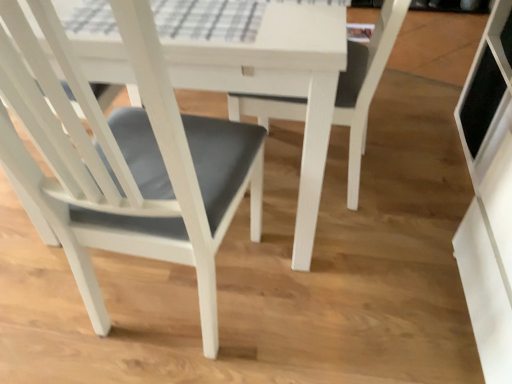
The height and width of the screenshot is (384, 512). What do you see at coordinates (125, 160) in the screenshot?
I see `matte gray cushion at center, positioned as the first chair in left-to-right order` at bounding box center [125, 160].

I want to click on matte gray cushion at center, placed as the second chair when sorted from right to left, so click(x=125, y=160).

What do you see at coordinates (365, 86) in the screenshot? The image size is (512, 384). I see `matte gray cushion at center, which is counted as the 1th chair, starting from the right` at bounding box center [365, 86].

Where is `matte gray cushion at center, which is counted as the 1th chair, starting from the right`? The image size is (512, 384). matte gray cushion at center, which is counted as the 1th chair, starting from the right is located at coordinates (365, 86).

At what (x,y) coordinates should I click in order to perform the action: click on matte gray cushion at center, placed as the second chair when sorted from right to left. Please return your answer as a coordinate pair (x, y). Looking at the image, I should click on (125, 160).

Considering the relative positions of matte gray cushion at center, placed as the second chair when sorted from right to left, and matte gray cushion at center, positioned as the 2th chair in left-to-right order, in the image provided, is matte gray cushion at center, placed as the second chair when sorted from right to left, to the left or to the right of matte gray cushion at center, positioned as the 2th chair in left-to-right order,?

From the image, it's evident that matte gray cushion at center, placed as the second chair when sorted from right to left, is to the left of matte gray cushion at center, positioned as the 2th chair in left-to-right order.

Considering the positions of objects matte gray cushion at center, placed as the second chair when sorted from right to left, and matte gray cushion at center, positioned as the 2th chair in left-to-right order, in the image provided, who is in front, matte gray cushion at center, placed as the second chair when sorted from right to left, or matte gray cushion at center, positioned as the 2th chair in left-to-right order,?

matte gray cushion at center, placed as the second chair when sorted from right to left, is more forward.

Does point (195, 150) appear closer or farther from the camera than point (348, 172)?

Point (195, 150) is closer to the camera than point (348, 172).

From the image's perspective, is matte gray cushion at center, positioned as the first chair in left-to-right order, beneath matte gray cushion at center, which is counted as the 1th chair, starting from the right?

No, from the image's perspective, matte gray cushion at center, positioned as the first chair in left-to-right order, is not beneath matte gray cushion at center, which is counted as the 1th chair, starting from the right.

From a real-world perspective, is matte gray cushion at center, positioned as the first chair in left-to-right order, above or below matte gray cushion at center, which is counted as the 1th chair, starting from the right?

From a real-world perspective, matte gray cushion at center, positioned as the first chair in left-to-right order, is physically below matte gray cushion at center, which is counted as the 1th chair, starting from the right.

Considering the sizes of matte gray cushion at center, positioned as the first chair in left-to-right order, and matte gray cushion at center, positioned as the 2th chair in left-to-right order, in the image, is matte gray cushion at center, positioned as the first chair in left-to-right order, wider or thinner than matte gray cushion at center, positioned as the 2th chair in left-to-right order,?

Considering their sizes, matte gray cushion at center, positioned as the first chair in left-to-right order, looks broader than matte gray cushion at center, positioned as the 2th chair in left-to-right order.

Between matte gray cushion at center, positioned as the first chair in left-to-right order, and matte gray cushion at center, positioned as the 2th chair in left-to-right order, which one has more height?

matte gray cushion at center, positioned as the 2th chair in left-to-right order.

Which of these two, matte gray cushion at center, positioned as the first chair in left-to-right order, or matte gray cushion at center, positioned as the 2th chair in left-to-right order, is smaller?

matte gray cushion at center, positioned as the 2th chair in left-to-right order.

Is matte gray cushion at center, positioned as the 2th chair in left-to-right order, inside matte gray cushion at center, positioned as the first chair in left-to-right order?

Yes, matte gray cushion at center, positioned as the 2th chair in left-to-right order, can be found within matte gray cushion at center, positioned as the first chair in left-to-right order.

Is matte gray cushion at center, placed as the second chair when sorted from right to left, directly adjacent to matte gray cushion at center, which is counted as the 1th chair, starting from the right?

They are not placed beside each other.

Based on the photo, could you tell me if matte gray cushion at center, positioned as the first chair in left-to-right order, is facing matte gray cushion at center, which is counted as the 1th chair, starting from the right?

Yes, matte gray cushion at center, positioned as the first chair in left-to-right order, is facing matte gray cushion at center, which is counted as the 1th chair, starting from the right.

What's the angular difference between matte gray cushion at center, placed as the second chair when sorted from right to left, and matte gray cushion at center, positioned as the 2th chair in left-to-right order,'s facing directions?

The facing directions of matte gray cushion at center, placed as the second chair when sorted from right to left, and matte gray cushion at center, positioned as the 2th chair in left-to-right order, are 5.62 degrees apart.

This screenshot has width=512, height=384. Find the location of `chair on the right side of matte gray cushion at center, positioned as the first chair in left-to-right order`. chair on the right side of matte gray cushion at center, positioned as the first chair in left-to-right order is located at coordinates (365, 86).

Which is more to the left, matte gray cushion at center, positioned as the 2th chair in left-to-right order, or matte gray cushion at center, placed as the second chair when sorted from right to left?

Positioned to the left is matte gray cushion at center, placed as the second chair when sorted from right to left.

Who is more distant, matte gray cushion at center, positioned as the 2th chair in left-to-right order, or matte gray cushion at center, placed as the second chair when sorted from right to left?

Positioned behind is matte gray cushion at center, positioned as the 2th chair in left-to-right order.

Is point (385, 21) farther from camera compared to point (67, 165)?

Yes, point (385, 21) is behind point (67, 165).

From the image's perspective, who appears lower, matte gray cushion at center, which is counted as the 1th chair, starting from the right, or matte gray cushion at center, positioned as the first chair in left-to-right order?

matte gray cushion at center, which is counted as the 1th chair, starting from the right, is shown below in the image.

From a real-world perspective, is matte gray cushion at center, positioned as the 2th chair in left-to-right order, physically located above or below matte gray cushion at center, positioned as the first chair in left-to-right order?

matte gray cushion at center, positioned as the 2th chair in left-to-right order, is situated higher than matte gray cushion at center, positioned as the first chair in left-to-right order, in the real world.

Considering the sizes of objects matte gray cushion at center, which is counted as the 1th chair, starting from the right, and matte gray cushion at center, positioned as the first chair in left-to-right order, in the image provided, who is thinner, matte gray cushion at center, which is counted as the 1th chair, starting from the right, or matte gray cushion at center, positioned as the first chair in left-to-right order,?

Thinner between the two is matte gray cushion at center, which is counted as the 1th chair, starting from the right.

Is matte gray cushion at center, positioned as the 2th chair in left-to-right order, taller than matte gray cushion at center, positioned as the first chair in left-to-right order?

Correct, matte gray cushion at center, positioned as the 2th chair in left-to-right order, is much taller as matte gray cushion at center, positioned as the first chair in left-to-right order.

Considering the relative sizes of matte gray cushion at center, which is counted as the 1th chair, starting from the right, and matte gray cushion at center, positioned as the first chair in left-to-right order, in the image provided, is matte gray cushion at center, which is counted as the 1th chair, starting from the right, bigger than matte gray cushion at center, positioned as the first chair in left-to-right order,?

Actually, matte gray cushion at center, which is counted as the 1th chair, starting from the right, might be smaller than matte gray cushion at center, positioned as the first chair in left-to-right order.

Is matte gray cushion at center, positioned as the 2th chair in left-to-right order, inside the boundaries of matte gray cushion at center, positioned as the first chair in left-to-right order, or outside?

matte gray cushion at center, positioned as the 2th chair in left-to-right order, can be found inside matte gray cushion at center, positioned as the first chair in left-to-right order.

Is matte gray cushion at center, which is counted as the 1th chair, starting from the right, next to matte gray cushion at center, placed as the second chair when sorted from right to left, and touching it?

No.

Could you tell me if matte gray cushion at center, positioned as the 2th chair in left-to-right order, is facing matte gray cushion at center, positioned as the first chair in left-to-right order?

Yes.

Looking at this image, how different are the orientations of matte gray cushion at center, positioned as the 2th chair in left-to-right order, and matte gray cushion at center, positioned as the first chair in left-to-right order, in degrees?

The facing directions of matte gray cushion at center, positioned as the 2th chair in left-to-right order, and matte gray cushion at center, positioned as the first chair in left-to-right order, are 5.62 degrees apart.

How distant is matte gray cushion at center, which is counted as the 1th chair, starting from the right, from matte gray cushion at center, positioned as the first chair in left-to-right order?

They are 18.47 inches apart.

Find the location of a particular element. chair located underneath the matte gray cushion at center, which is counted as the 1th chair, starting from the right (from a real-world perspective) is located at coordinates (125, 160).

Image resolution: width=512 pixels, height=384 pixels. I want to click on chair below the matte gray cushion at center, positioned as the first chair in left-to-right order (from the image's perspective), so click(x=365, y=86).

The height and width of the screenshot is (384, 512). I want to click on chair on the left of matte gray cushion at center, which is counted as the 1th chair, starting from the right, so click(125, 160).